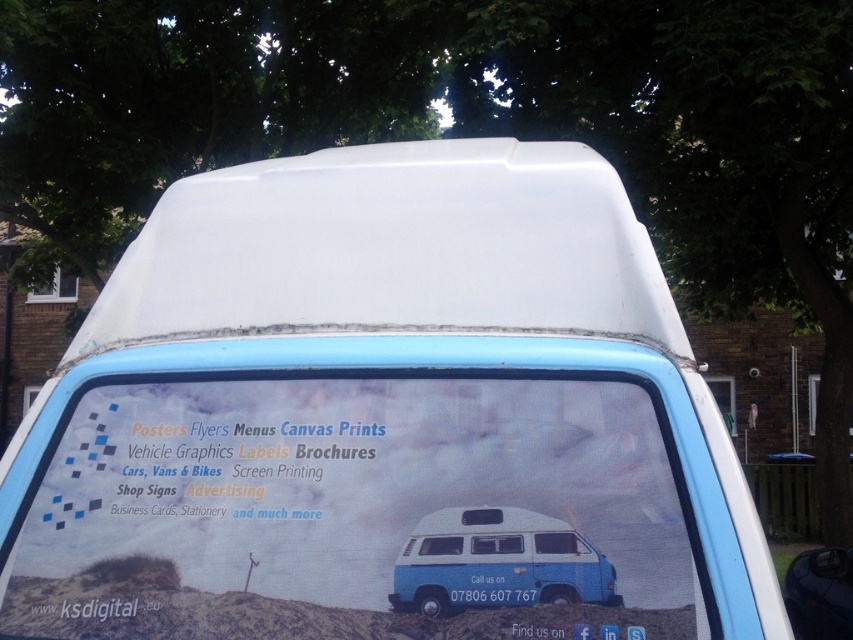
Looking at the advertisement on the white van with blue trim, where is the blue matte van at center in relation to the white plastic license plate at center?

The blue matte van at center is to the right of the white plastic license plate at center.

You are a graphic designer trying to create a new advertisement for a van. You need to know the relative sizes of the blue matte van at center and the white plastic license plate at center to scale your design properly. Which object is taller?

The blue matte van at center is taller than the white plastic license plate at center.